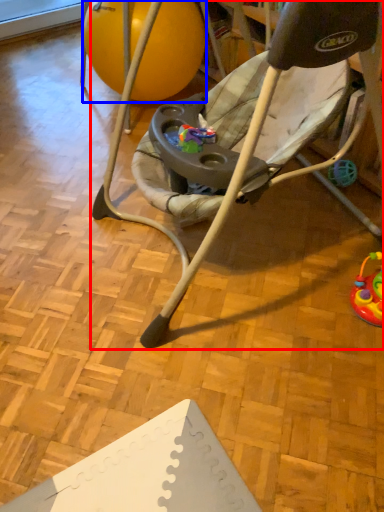
Question: Which object is further to the camera taking this photo, chair (highlighted by a red box) or ball (highlighted by a blue box)?

Choices:
 (A) chair
 (B) ball

Answer: (B)